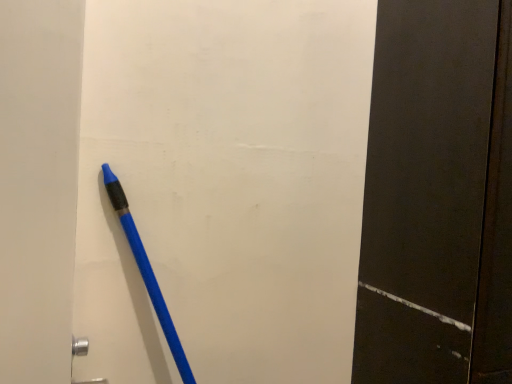
This screenshot has width=512, height=384. What do you see at coordinates (438, 197) in the screenshot?
I see `matte black screen door at right` at bounding box center [438, 197].

Looking at this image, measure the distance between matte black screen door at right and camera.

A distance of 63.66 centimeters exists between matte black screen door at right and camera.

Locate an element on the screen. The height and width of the screenshot is (384, 512). matte black screen door at right is located at coordinates (438, 197).

Identify the location of matte black screen door at right. The image size is (512, 384). (438, 197).